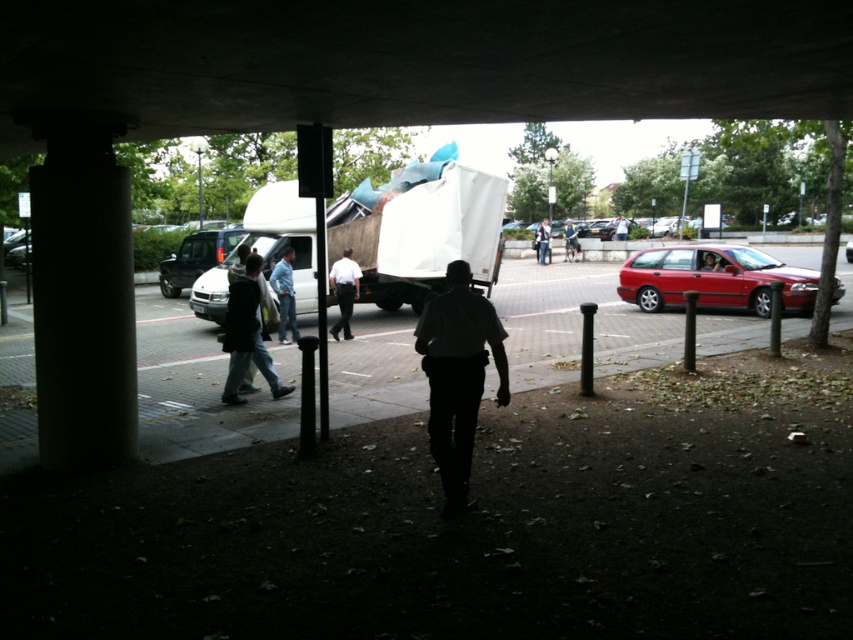
From the picture: You are standing at the base of the overpass and want to place a 10 meter long ladder between the concrete ceiling at upper center and the blue jeans at center. Is there enough space vertically?

The distance between the concrete ceiling at upper center and the blue jeans at center is 9.65 meters. Since the ladder is 10 meters long, it would not fit vertically in the available space.

What is the exact coordinate of the concrete pavement at center?

The concrete pavement at center is located at point (575, 323).

You are standing at the edge of the overpass and want to walk to the white van parked near the edge. You see the concrete pavement at center and the light blue jeans at center. Which object is closer to you?

The concrete pavement at center is closer to you because it is in front of the light blue jeans at center.